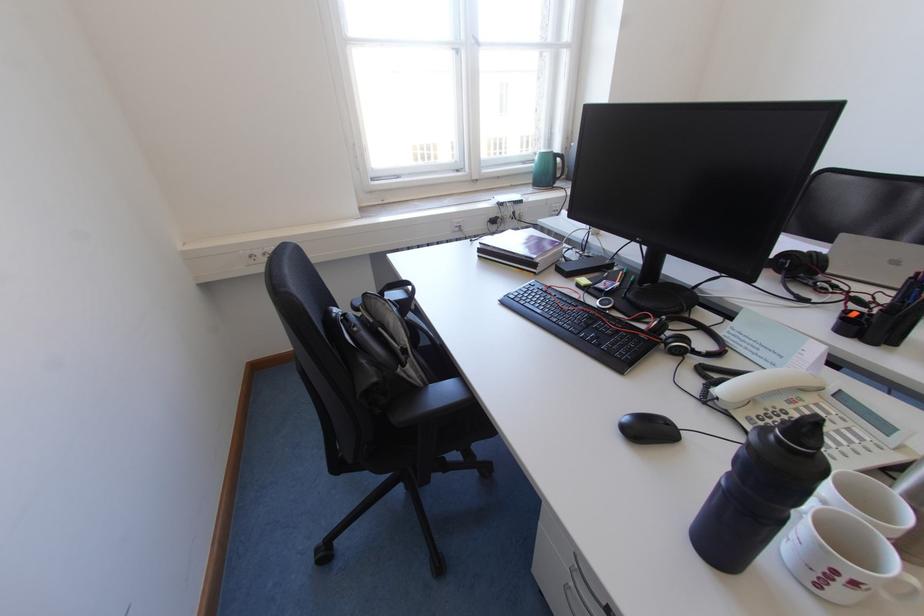
Identify the location of green pitcher handle. Image resolution: width=924 pixels, height=616 pixels. (562, 166).